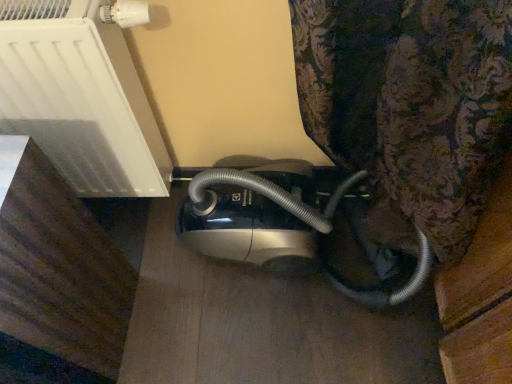
Locate an element on the screen. The image size is (512, 384). satin silver vacuum cleaner at lower center is located at coordinates (82, 94).

Describe the element at coordinates (82, 94) in the screenshot. The width and height of the screenshot is (512, 384). I see `satin silver vacuum cleaner at lower center` at that location.

In order to face satin silver vacuum cleaner at lower center, should I rotate leftwards or rightwards?

It's best to rotate left around 23.491 degrees.

This screenshot has width=512, height=384. What do you see at coordinates (292, 225) in the screenshot? I see `metallic silver vacuum cleaner at center` at bounding box center [292, 225].

This screenshot has width=512, height=384. I want to click on metallic silver vacuum cleaner at center, so click(x=292, y=225).

Locate an element on the screen. The image size is (512, 384). satin silver vacuum cleaner at lower center is located at coordinates (82, 94).

Is metallic silver vacuum cleaner at center at the left side of satin silver vacuum cleaner at lower center?

In fact, metallic silver vacuum cleaner at center is to the right of satin silver vacuum cleaner at lower center.

Which object is more forward, metallic silver vacuum cleaner at center or satin silver vacuum cleaner at lower center?

Positioned in front is satin silver vacuum cleaner at lower center.

Which point is more forward, (395,300) or (126,163)?

The point (126,163) is in front.

From the image's perspective, which is below, metallic silver vacuum cleaner at center or satin silver vacuum cleaner at lower center?

From the image's view, metallic silver vacuum cleaner at center is below.

From a real-world perspective, does metallic silver vacuum cleaner at center stand above satin silver vacuum cleaner at lower center?

Incorrect, from a real-world perspective, metallic silver vacuum cleaner at center is lower than satin silver vacuum cleaner at lower center.

Which object is thinner, metallic silver vacuum cleaner at center or satin silver vacuum cleaner at lower center?

satin silver vacuum cleaner at lower center is thinner.

Who is taller, metallic silver vacuum cleaner at center or satin silver vacuum cleaner at lower center?

satin silver vacuum cleaner at lower center.

Who is smaller, metallic silver vacuum cleaner at center or satin silver vacuum cleaner at lower center?

Smaller between the two is satin silver vacuum cleaner at lower center.

Is satin silver vacuum cleaner at lower center a part of metallic silver vacuum cleaner at center?

Actually, satin silver vacuum cleaner at lower center is outside metallic silver vacuum cleaner at center.

Does metallic silver vacuum cleaner at center touch satin silver vacuum cleaner at lower center?

No, metallic silver vacuum cleaner at center is not beside satin silver vacuum cleaner at lower center.

In the scene shown: Does metallic silver vacuum cleaner at center turn towards satin silver vacuum cleaner at lower center?

No.

Measure the distance between metallic silver vacuum cleaner at center and satin silver vacuum cleaner at lower center.

metallic silver vacuum cleaner at center is 14.41 inches from satin silver vacuum cleaner at lower center.

You are a GUI agent. You are given a task and a screenshot of the screen. Output one action in this format:
    pyautogui.click(x=<x>, y=<y>)
    Task: Click on the appliance above the metallic silver vacuum cleaner at center (from a real-world perspective)
    
    Given the screenshot: What is the action you would take?
    pyautogui.click(x=82, y=94)

Which is more to the right, satin silver vacuum cleaner at lower center or metallic silver vacuum cleaner at center?

Positioned to the right is metallic silver vacuum cleaner at center.

Does satin silver vacuum cleaner at lower center lie behind metallic silver vacuum cleaner at center?

No, it is not.

Between point (25, 79) and point (375, 252), which one is positioned behind?

The point (375, 252) is farther from the camera.

From the image's perspective, who appears lower, satin silver vacuum cleaner at lower center or metallic silver vacuum cleaner at center?

metallic silver vacuum cleaner at center.

From a real-world perspective, does satin silver vacuum cleaner at lower center sit lower than metallic silver vacuum cleaner at center?

No, from a real-world perspective, satin silver vacuum cleaner at lower center is not beneath metallic silver vacuum cleaner at center.

In terms of width, does satin silver vacuum cleaner at lower center look wider or thinner when compared to metallic silver vacuum cleaner at center?

satin silver vacuum cleaner at lower center is thinner than metallic silver vacuum cleaner at center.

Considering the sizes of satin silver vacuum cleaner at lower center and metallic silver vacuum cleaner at center in the image, is satin silver vacuum cleaner at lower center taller or shorter than metallic silver vacuum cleaner at center?

Considering their sizes, satin silver vacuum cleaner at lower center has more height than metallic silver vacuum cleaner at center.

Is satin silver vacuum cleaner at lower center bigger or smaller than metallic silver vacuum cleaner at center?

In the image, satin silver vacuum cleaner at lower center appears to be smaller than metallic silver vacuum cleaner at center.

Is satin silver vacuum cleaner at lower center inside the boundaries of metallic silver vacuum cleaner at center, or outside?

satin silver vacuum cleaner at lower center is located beyond the bounds of metallic silver vacuum cleaner at center.

Are satin silver vacuum cleaner at lower center and metallic silver vacuum cleaner at center far apart?

No.

Is metallic silver vacuum cleaner at center at the back of satin silver vacuum cleaner at lower center?

No, satin silver vacuum cleaner at lower center is not facing the opposite direction of metallic silver vacuum cleaner at center.

Can you tell me how much satin silver vacuum cleaner at lower center and metallic silver vacuum cleaner at center differ in facing direction?

There is a 3.48-degree angle between the facing directions of satin silver vacuum cleaner at lower center and metallic silver vacuum cleaner at center.

The width and height of the screenshot is (512, 384). Identify the location of appliance above the metallic silver vacuum cleaner at center (from the image's perspective). (82, 94).

Locate an element on the screen. appliance in front of the metallic silver vacuum cleaner at center is located at coordinates (82, 94).

The height and width of the screenshot is (384, 512). What are the coordinates of `appliance located above the metallic silver vacuum cleaner at center (from the image's perspective)` in the screenshot? It's located at (82, 94).